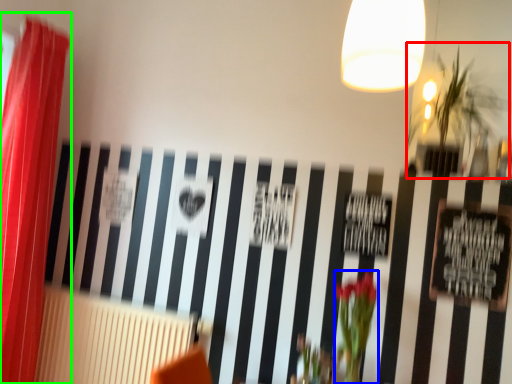
Question: Which is nearer to the plant (highlighted by a red box)? floral arrangement (highlighted by a blue box) or curtain (highlighted by a green box).

Choices:
 (A) floral arrangement
 (B) curtain

Answer: (A)